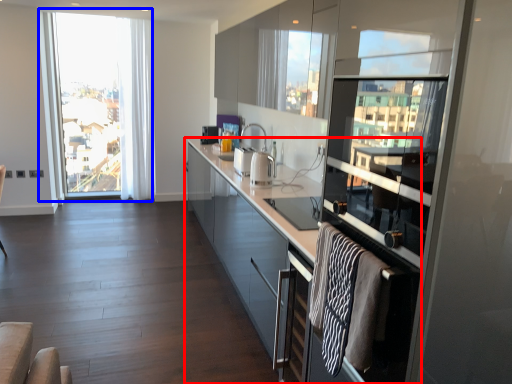
Question: Which of the following is the closest to the observer, cabinetry (highlighted by a red box) or window (highlighted by a blue box)?

Choices:
 (A) cabinetry
 (B) window

Answer: (A)